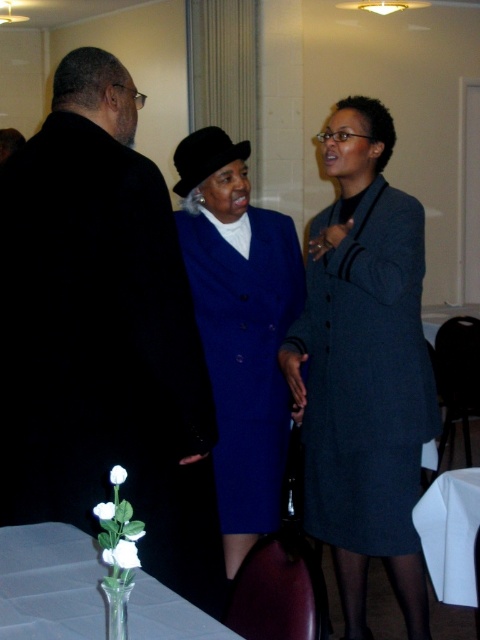
You are standing at the point with coordinates point [456,602] and want to walk to the exit located at point [310,310]. Is there any obstruction between you and the exit?

Point [310,310] is behind point [456,602], so there is an obstruction between you and the exit.

You are at a formal event and need to place your dark gray wool coat somewhere. You see the dark gray wool coat at center and the clear glass vase at lower left. Which object is positioned to the right of the other?

The dark gray wool coat at center is to the right of the clear glass vase at lower left.